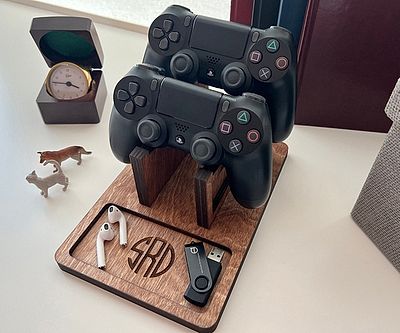
Find the location of `wooden planks that the controllers are resting on`. wooden planks that the controllers are resting on is located at coordinates (149, 165), (201, 181).